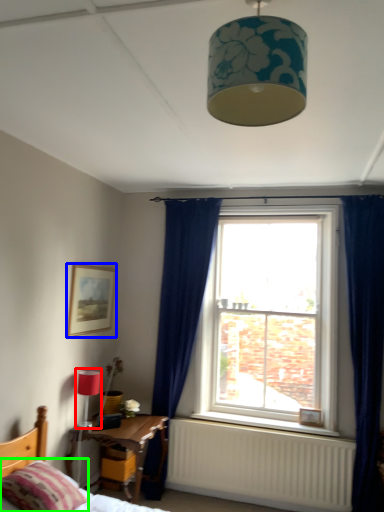
Question: Which object is positioned farthest from lamp (highlighted by a red box)? Select from picture frame (highlighted by a blue box) and pillow (highlighted by a green box).

Choices:
 (A) picture frame
 (B) pillow

Answer: (B)